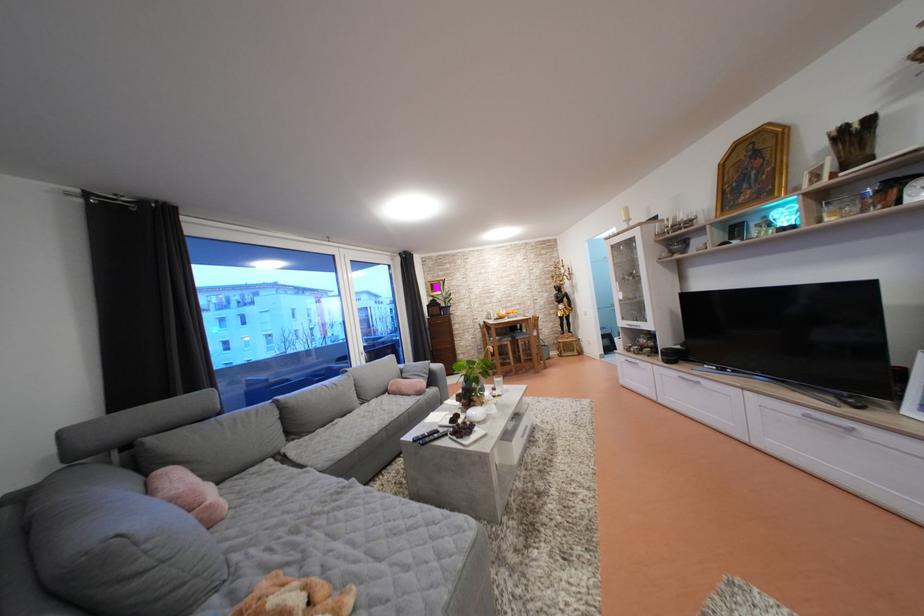
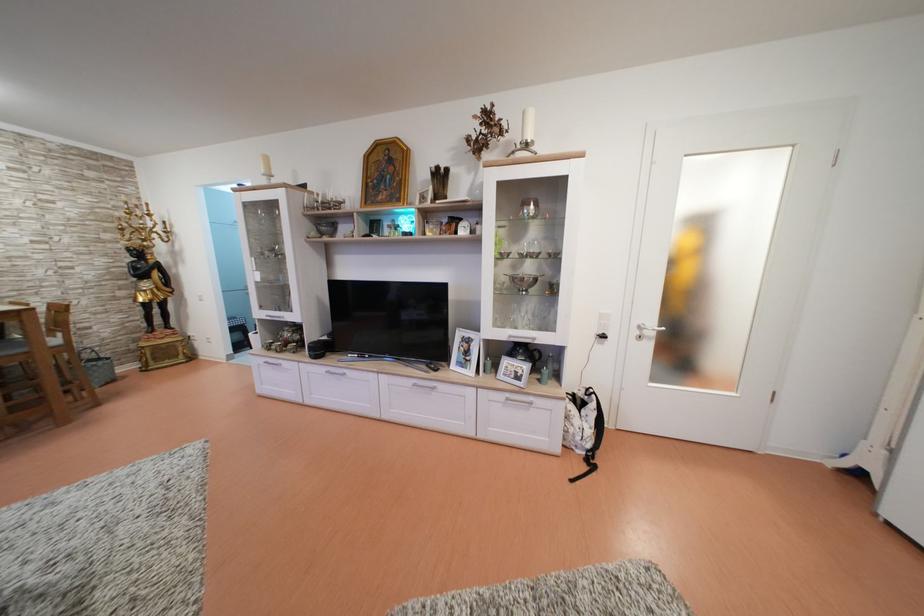
Question: I am providing you with two images of the same scene from different viewpoints. Which of the following objects are not visible in image2?

Choices:
 (A) silver door handle
 (B) black remote control
 (C) black telephone receiver
 (D) none of these

Answer: (D)